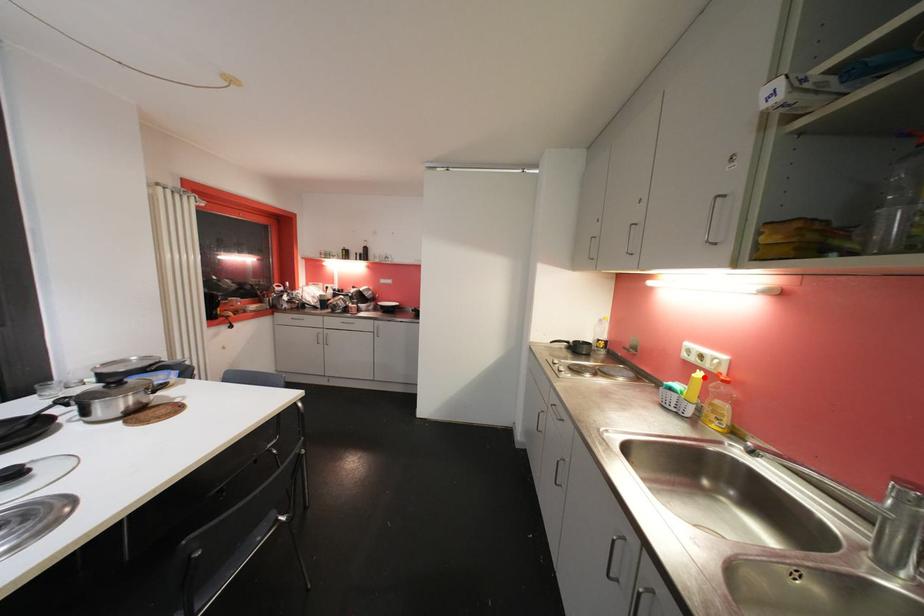
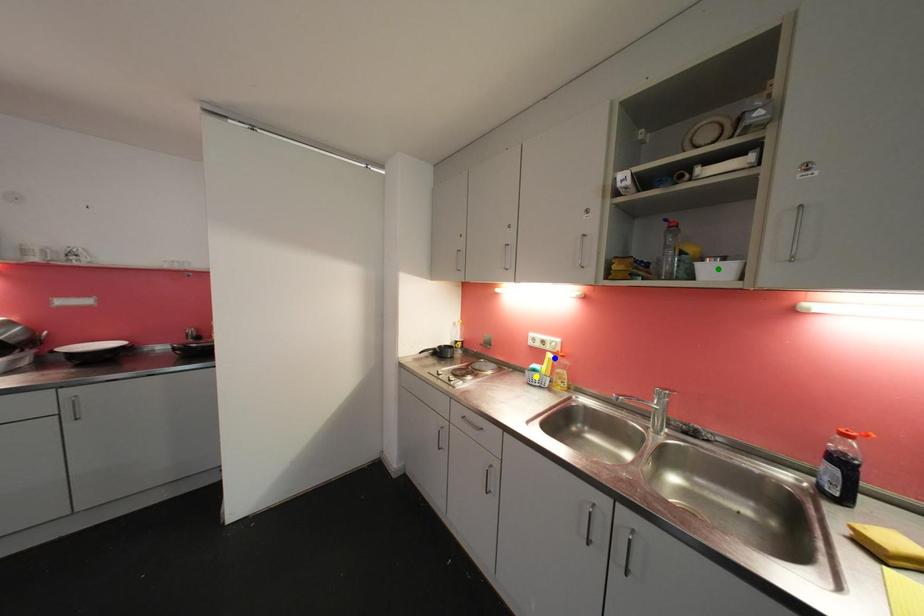
Question: I am providing you with two images of the same scene from different viewpoints. A red point is marked on the first image. You are given multiple points on the second image. Which point in image 2 is actually the same real-world point as the red point in image 1?

Choices:
 (A) blue point
 (B) green point
 (C) yellow point

Answer: (A)